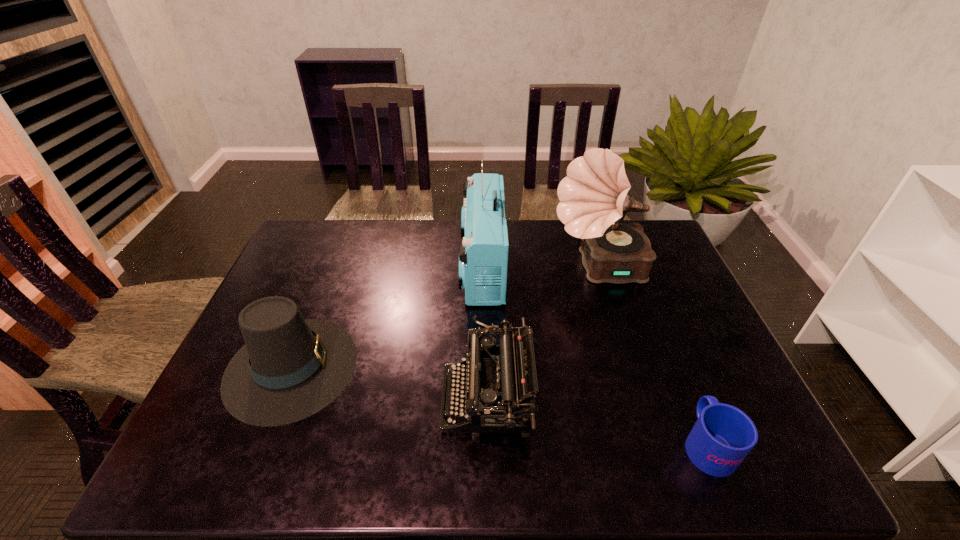
Image resolution: width=960 pixels, height=540 pixels. Find the location of `free space at the far left corner`. free space at the far left corner is located at coordinates (329, 253).

At what (x,y) coordinates should I click in order to perform the action: click on blank space at the far right corner of the desktop. Please return your answer as a coordinate pair (x, y). Looking at the image, I should click on (646, 226).

Locate an element on the screen. This screenshot has height=540, width=960. free space at the near right corner of the desktop is located at coordinates (786, 465).

Locate an element on the screen. This screenshot has width=960, height=540. free point between the typewriter and the mug is located at coordinates (597, 422).

I want to click on free area in between the record player and the typewriter, so click(x=543, y=334).

Find the location of `free space between the tallest object and the typewriter`. free space between the tallest object and the typewriter is located at coordinates (543, 334).

Find the location of `free spot between the second tallest object and the typewriter`. free spot between the second tallest object and the typewriter is located at coordinates (485, 333).

Where is `free spot between the typewriter and the record player`? The height and width of the screenshot is (540, 960). free spot between the typewriter and the record player is located at coordinates (543, 334).

You are a GUI agent. You are given a task and a screenshot of the screen. Output one action in this format:
    pyautogui.click(x=<x>, y=<y>)
    Task: Click on the free spot between the tallest object and the shortest object
    
    Given the screenshot: What is the action you would take?
    pyautogui.click(x=653, y=356)

The width and height of the screenshot is (960, 540). What are the coordinates of `empty location between the hat and the typewriter` in the screenshot? It's located at (390, 383).